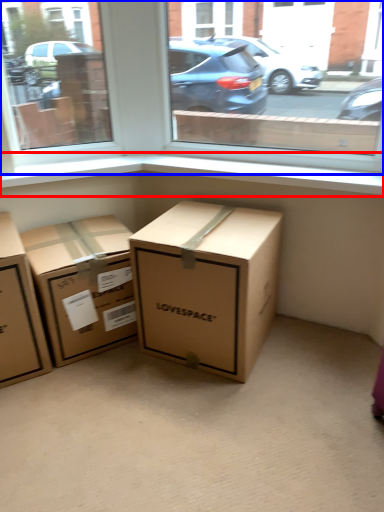
Question: Among these objects, which one is farthest to the camera, window sill (highlighted by a red box) or window (highlighted by a blue box)?

Choices:
 (A) window sill
 (B) window

Answer: (A)